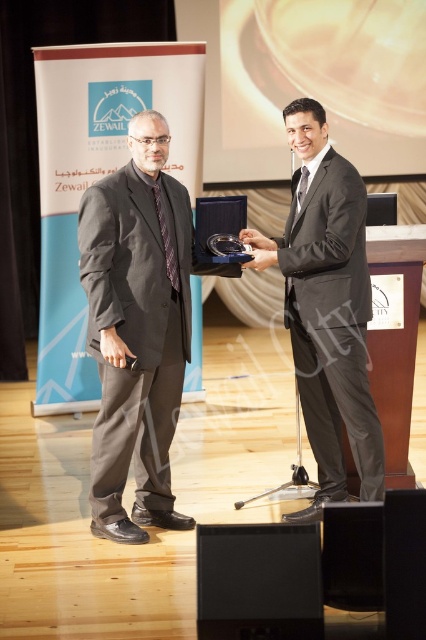
In the scene shown: Between matte black suit at left and shiny black suit at center, which one is positioned higher?

shiny black suit at center

Is matte black suit at left below shiny black suit at center?

Yes, matte black suit at left is below shiny black suit at center.

Locate an element on the screen. This screenshot has height=640, width=426. matte black suit at left is located at coordinates (138, 328).